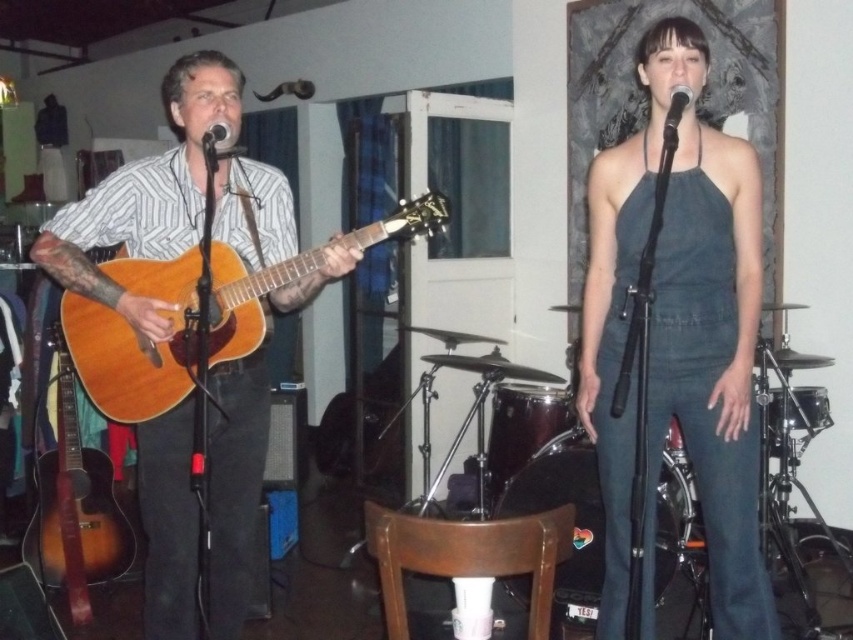
Question: Estimate the real-world distances between objects in this image. Which object is closer to the matte wood guitar at left?

Choices:
 (A) sunburst wood guitar at left
 (B) dark denim jumpsuit at center

Answer: (A)

Question: Which object is the farthest from the dark denim jumpsuit at center?

Choices:
 (A) matte wood guitar at left
 (B) sunburst wood guitar at left
 (C) black matte microphone at upper center
 (D) wooden acoustic guitar at left

Answer: (B)

Question: Does wooden acoustic guitar at left have a smaller size compared to black matte microphone at center?

Choices:
 (A) yes
 (B) no

Answer: (B)

Question: Is matte wood guitar at left bigger than black matte microphone at center?

Choices:
 (A) no
 (B) yes

Answer: (B)

Question: Which point is closer to the camera?

Choices:
 (A) dark denim jumpsuit at center
 (B) matte wood guitar at left

Answer: (A)

Question: Can you confirm if wooden acoustic guitar at left is wider than sunburst wood guitar at left?

Choices:
 (A) no
 (B) yes

Answer: (B)